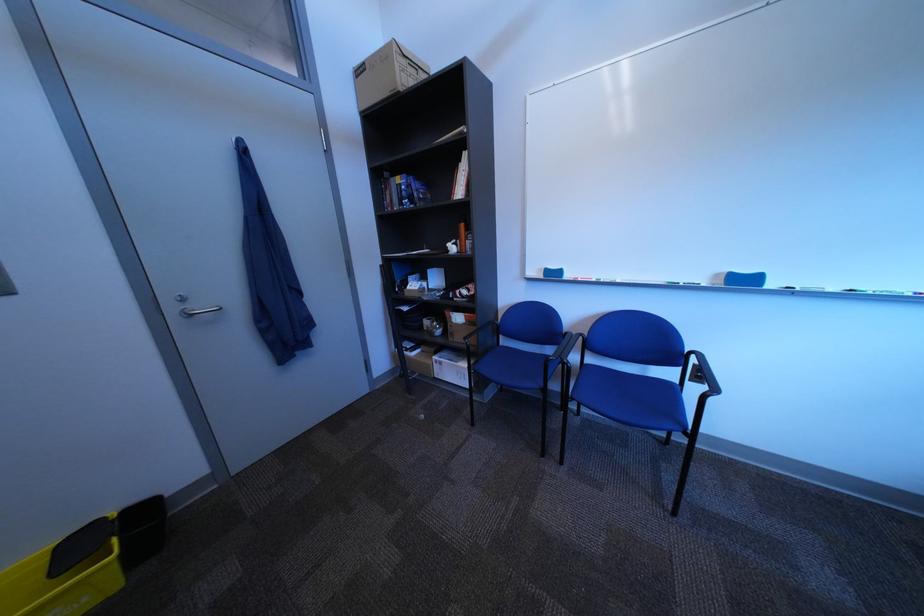
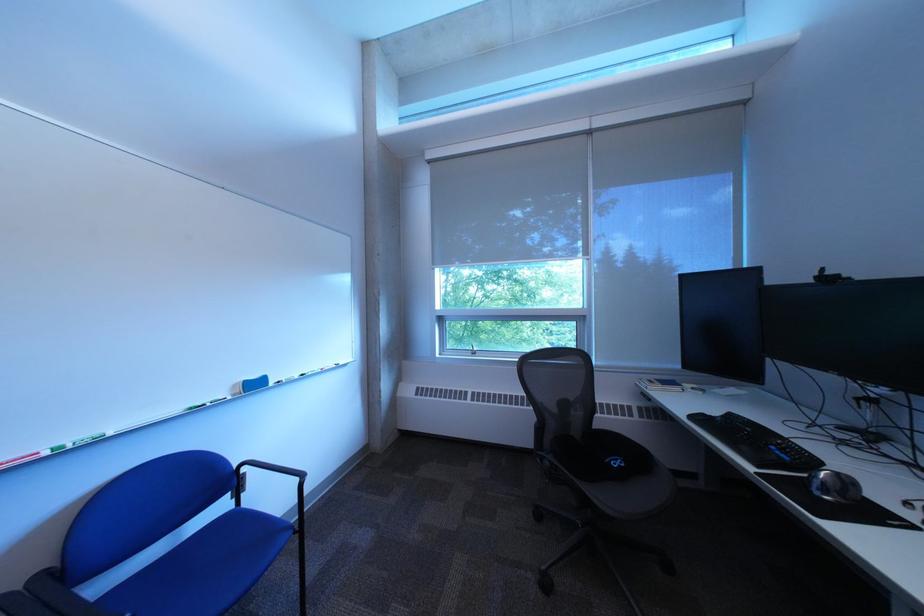
In the second image, find the point that corresponds to (691,384) in the first image.

(248, 508)